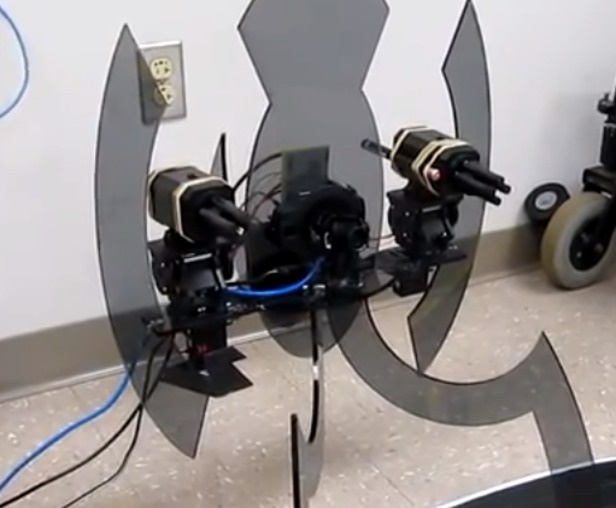
Find the location of a particular element. This screenshot has width=616, height=508. top power outlet is located at coordinates (163, 67).